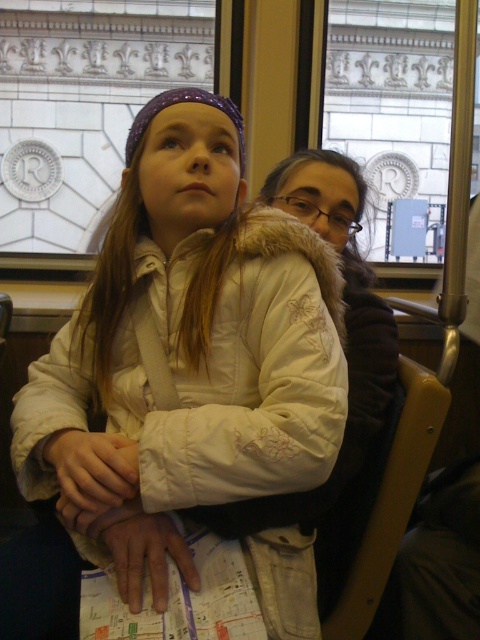
Question: Does white fuzzy coat at center appear over white fur coat at center?

Choices:
 (A) yes
 (B) no

Answer: (B)

Question: Does white fuzzy coat at center have a lesser width compared to white fur coat at center?

Choices:
 (A) no
 (B) yes

Answer: (A)

Question: Does white fuzzy coat at center appear under white fur coat at center?

Choices:
 (A) yes
 (B) no

Answer: (A)

Question: Which point is farther from the camera taking this photo?

Choices:
 (A) (320, 193)
 (B) (232, 316)

Answer: (A)

Question: Which of the following is the closest to the observer?

Choices:
 (A) white fur coat at center
 (B) white fuzzy coat at center

Answer: (B)

Question: Which point is closer to the camera?

Choices:
 (A) white fuzzy coat at center
 (B) white fur coat at center

Answer: (A)